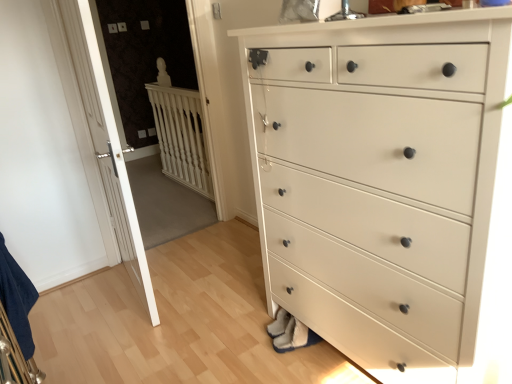
Question: From their relative heights in the image, would you say white wooden door at left is taller or shorter than white painted wood chest of drawers at center?

Choices:
 (A) tall
 (B) short

Answer: (A)

Question: In the image, is white wooden door at left on the left side or the right side of white painted wood chest of drawers at center?

Choices:
 (A) right
 (B) left

Answer: (B)

Question: Considering the real-world distances, which object is farthest from the white wooden door at left?

Choices:
 (A) white wood balustrade at upper left
 (B) white painted wood chest of drawers at center

Answer: (A)

Question: Which object is the farthest from the white wooden door at left?

Choices:
 (A) white wood balustrade at upper left
 (B) white painted wood chest of drawers at center

Answer: (A)